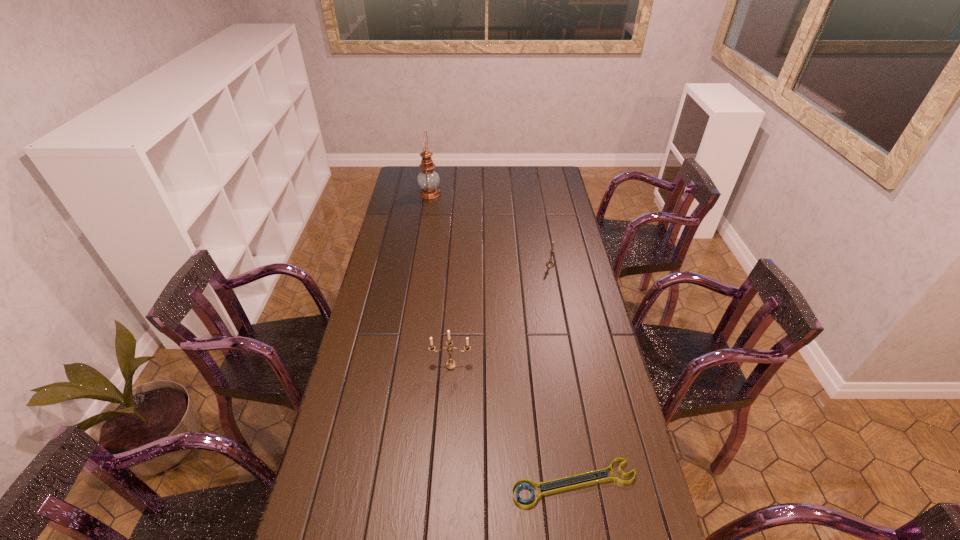
You are a GUI agent. You are given a task and a screenshot of the screen. Output one action in this format:
    pyautogui.click(x=<x>, y=<y>)
    Task: Click on the leftmost object
    This screenshot has height=540, width=960.
    Given the screenshot: What is the action you would take?
    pyautogui.click(x=428, y=180)

This screenshot has height=540, width=960. In order to click on the tallest object in this screenshot , I will do `click(428, 180)`.

Find the location of a particular element. The image size is (960, 540). the second tallest object is located at coordinates coord(449,364).

Identify the location of the taller candle. This screenshot has height=540, width=960. (449, 364).

Where is `the farther candle`? the farther candle is located at coordinates pos(550,264).

Identify the location of the second farthest object. 550,264.

Where is `the shortest object`? This screenshot has width=960, height=540. the shortest object is located at coordinates (547, 491).

Where is `the nearest object`? This screenshot has height=540, width=960. the nearest object is located at coordinates (547, 491).

The height and width of the screenshot is (540, 960). Identify the location of vacant space located on the front of the tallest object. (424, 227).

Image resolution: width=960 pixels, height=540 pixels. What are the coordinates of `free space located 0.220m on the left of the second tallest object` in the screenshot? It's located at (364, 364).